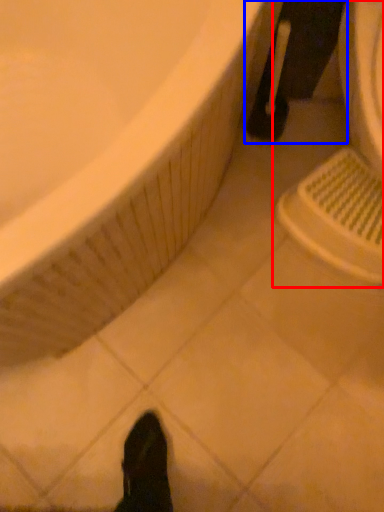
Question: Which object appears closest to the camera in this image, sink (highlighted by a red box) or leg (highlighted by a blue box)?

Choices:
 (A) sink
 (B) leg

Answer: (A)